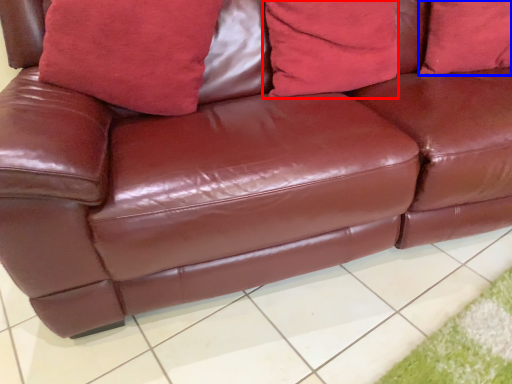
Question: Among these objects, which one is farthest to the camera, pillow (highlighted by a red box) or pillow (highlighted by a blue box)?

Choices:
 (A) pillow
 (B) pillow

Answer: (B)